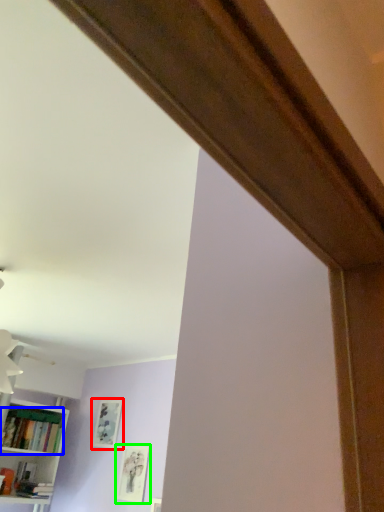
Question: Which object is the closest to the picture frame (highlighted by a red box)? Choose among these: book (highlighted by a blue box) or picture frame (highlighted by a green box).

Choices:
 (A) book
 (B) picture frame

Answer: (B)